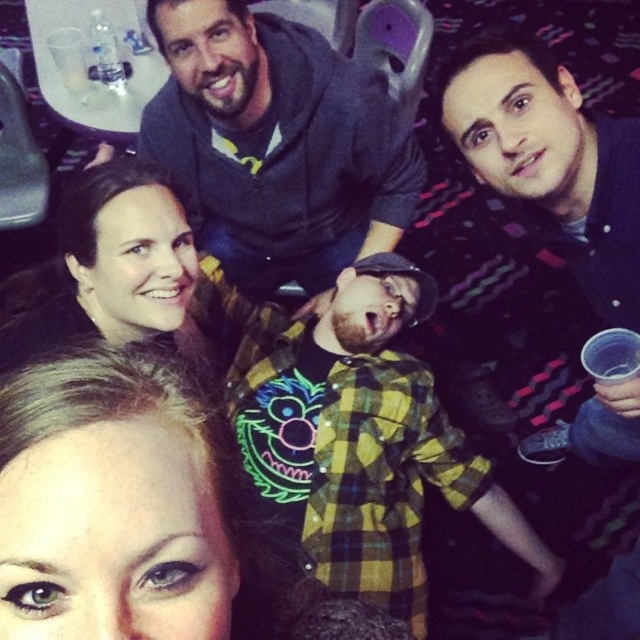
You are at a party and want to take a photo of the yellow plaid shirt at center and the matte gray hoodie at upper center. Which one should you position to the left side of your camera frame to include both in the picture?

To include both the yellow plaid shirt at center and the matte gray hoodie at upper center in your photo, position the matte gray hoodie at upper center on the left side of your camera frame since the yellow plaid shirt at center is already to its right.

You are at a party and want to take a photo of the matte gray hoodie at upper center and the matte black hair at upper left. Can you see both objects clearly in the photo if you take it from where the selfie is being taken?

The matte gray hoodie at upper center is positioned over matte black hair at upper left, so if you take the photo from the selfie position, the matte gray hoodie at upper center may block the view of the matte black hair at upper left, making it difficult to see both clearly.